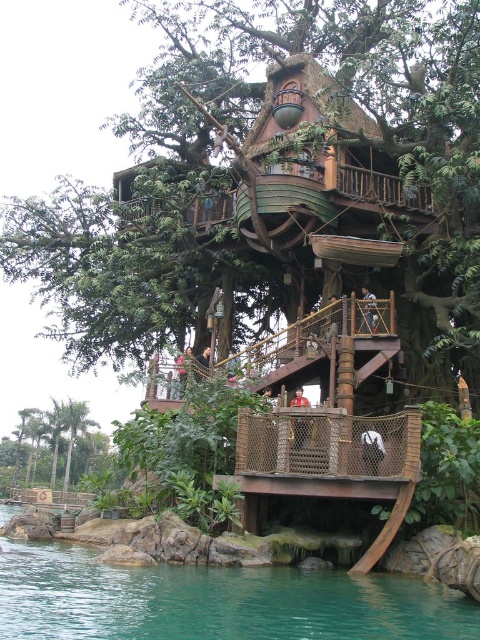
Question: Which point appears closest to the camera in this image?

Choices:
 (A) (406, 627)
 (B) (98, 451)

Answer: (A)

Question: Does teal glossy water at lower center lie behind green leafy palm trees at lower left?

Choices:
 (A) no
 (B) yes

Answer: (A)

Question: Is teal glossy water at lower center thinner than green leafy palm trees at lower left?

Choices:
 (A) no
 (B) yes

Answer: (A)

Question: Is teal glossy water at lower center closer to camera compared to green leafy palm trees at lower left?

Choices:
 (A) yes
 (B) no

Answer: (A)

Question: Which of the following is the farthest from the observer?

Choices:
 (A) green leafy palm trees at lower left
 (B) teal glossy water at lower center

Answer: (A)